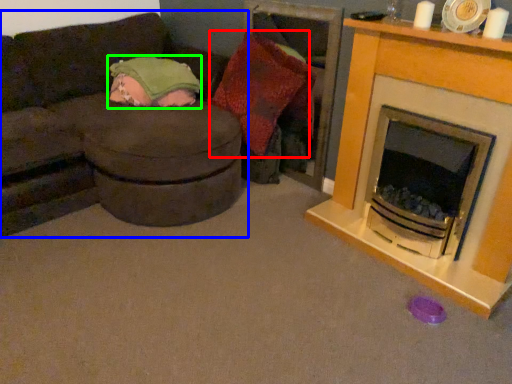
Question: Based on their relative distances, which object is farther from pillow (highlighted by a red box)? Choose from studio couch (highlighted by a blue box) and blanket (highlighted by a green box).

Choices:
 (A) studio couch
 (B) blanket

Answer: (A)